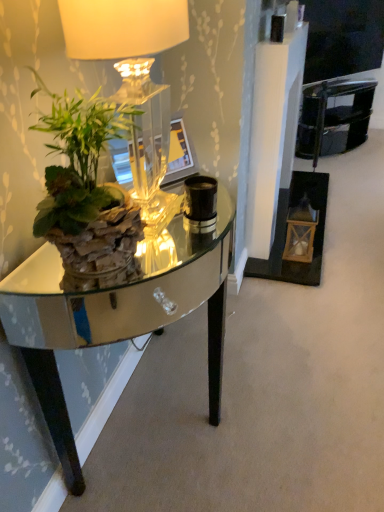
Question: From a real-world perspective, is black glossy armchair at upper right beneath clear glass table at left?

Choices:
 (A) no
 (B) yes

Answer: (B)

Question: Does black glossy armchair at upper right appear on the left side of clear glass table at left?

Choices:
 (A) no
 (B) yes

Answer: (A)

Question: From the image's perspective, is black glossy armchair at upper right on clear glass table at left?

Choices:
 (A) yes
 (B) no

Answer: (A)

Question: Is the surface of black glossy armchair at upper right in direct contact with clear glass table at left?

Choices:
 (A) no
 (B) yes

Answer: (A)

Question: Does black glossy armchair at upper right have a lesser width compared to clear glass table at left?

Choices:
 (A) yes
 (B) no

Answer: (A)

Question: Is black glossy armchair at upper right behind clear glass table at left?

Choices:
 (A) no
 (B) yes

Answer: (B)

Question: Is green leafy plant at left with clear glass table at left?

Choices:
 (A) yes
 (B) no

Answer: (B)

Question: Could you tell me if green leafy plant at left is turned towards clear glass table at left?

Choices:
 (A) no
 (B) yes

Answer: (A)

Question: Does green leafy plant at left have a lesser width compared to clear glass table at left?

Choices:
 (A) no
 (B) yes

Answer: (B)

Question: Can you confirm if green leafy plant at left is shorter than clear glass table at left?

Choices:
 (A) yes
 (B) no

Answer: (A)

Question: Does green leafy plant at left contain clear glass table at left?

Choices:
 (A) no
 (B) yes

Answer: (A)

Question: Considering the relative positions of green leafy plant at left and clear glass table at left in the image provided, is green leafy plant at left to the right of clear glass table at left from the viewer's perspective?

Choices:
 (A) yes
 (B) no

Answer: (B)

Question: Can you confirm if clear glass table at left is bigger than matte glass lamp at upper left?

Choices:
 (A) yes
 (B) no

Answer: (A)